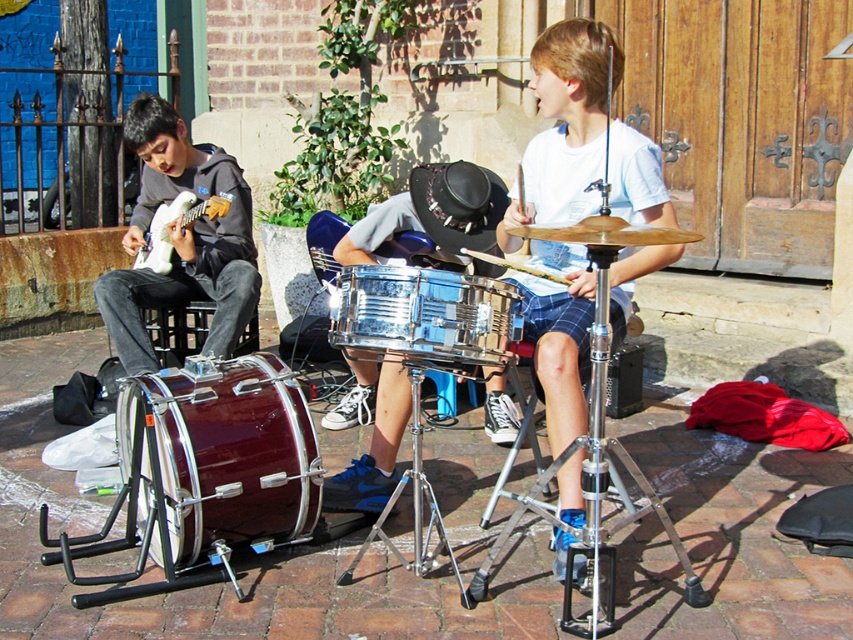
You are a photographer standing at the center of the street. You want to take a photo of the white matte drum at center. Where should you point your camera to capture it in the frame?

You should point your camera towards point 0.197 on the x axis and 0.664 on the y axis to capture the white matte drum at center in the frame.

You are standing at the point labeled point (639,253) and want to take a photo of the two musicians. The camera you have can only focus on objects within 10 feet. Will the camera be able to focus on the musicians?

The camera is 10.85 feet away from the point labeled point (639,253). Since the camera can only focus on objects within 10 feet, it will not be able to focus on the musicians.